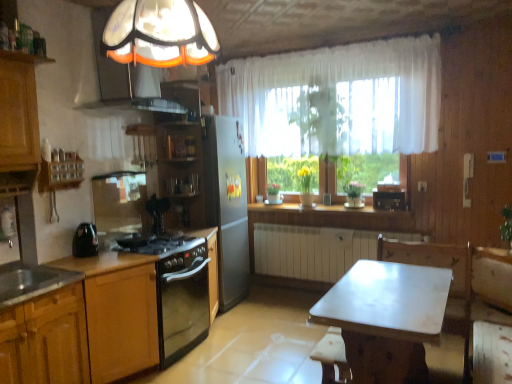
Question: From the image's perspective, is white sheer curtain at upper center located beneath wooden bar stool at lower center?

Choices:
 (A) yes
 (B) no

Answer: (B)

Question: Does white sheer curtain at upper center have a lesser height compared to wooden bar stool at lower center?

Choices:
 (A) yes
 (B) no

Answer: (B)

Question: Is white sheer curtain at upper center wider than wooden bar stool at lower center?

Choices:
 (A) yes
 (B) no

Answer: (A)

Question: From a real-world perspective, does white sheer curtain at upper center stand above wooden bar stool at lower center?

Choices:
 (A) yes
 (B) no

Answer: (A)

Question: Does white sheer curtain at upper center have a larger size compared to wooden bar stool at lower center?

Choices:
 (A) yes
 (B) no

Answer: (A)

Question: Can you confirm if white sheer curtain at upper center is positioned to the right of wooden bar stool at lower center?

Choices:
 (A) no
 (B) yes

Answer: (B)

Question: Can you confirm if white marble table at center is thinner than black glass gas stove at lower left?

Choices:
 (A) no
 (B) yes

Answer: (A)

Question: Is white marble table at center oriented away from black glass gas stove at lower left?

Choices:
 (A) yes
 (B) no

Answer: (B)

Question: Is white marble table at center outside black glass gas stove at lower left?

Choices:
 (A) yes
 (B) no

Answer: (A)

Question: Is white marble table at center further to camera compared to black glass gas stove at lower left?

Choices:
 (A) no
 (B) yes

Answer: (A)

Question: Is white marble table at center bigger than black glass gas stove at lower left?

Choices:
 (A) no
 (B) yes

Answer: (B)

Question: From the image's perspective, is white marble table at center located beneath black glass gas stove at lower left?

Choices:
 (A) no
 (B) yes

Answer: (B)

Question: Is white marble table at center at the left side of matte glass exhaust hood at upper left?

Choices:
 (A) no
 (B) yes

Answer: (A)